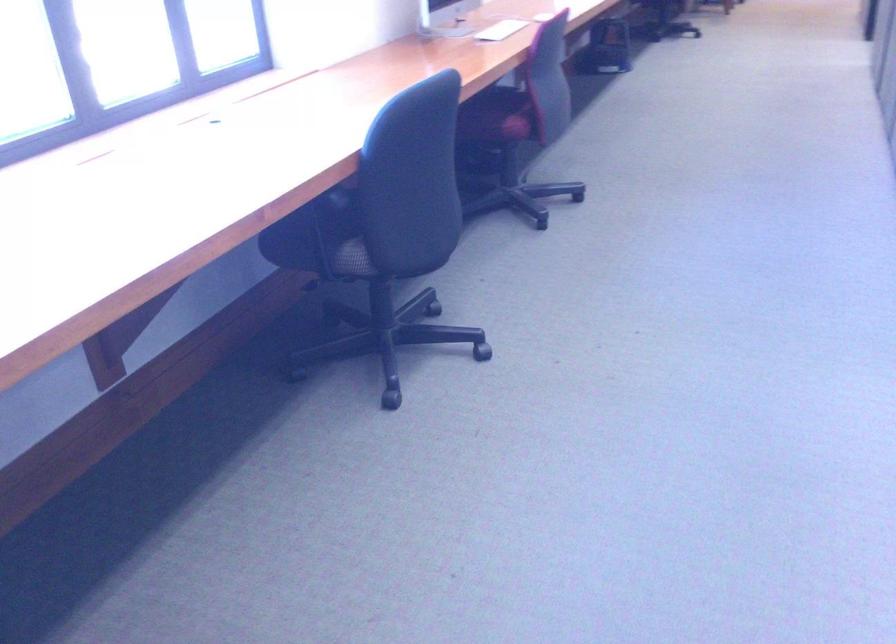
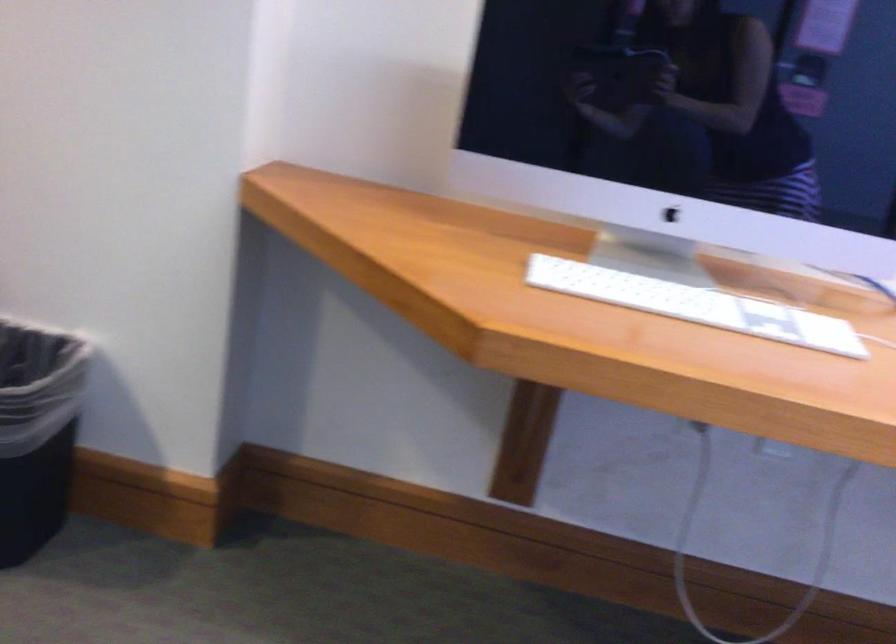
Question: The camera is either moving clockwise (left) or counter-clockwise (right) around the object. The first image is from the beginning of the video and the second image is from the end. Is the camera moving left or right when shooting the video?

Choices:
 (A) Left
 (B) Right

Answer: (B)